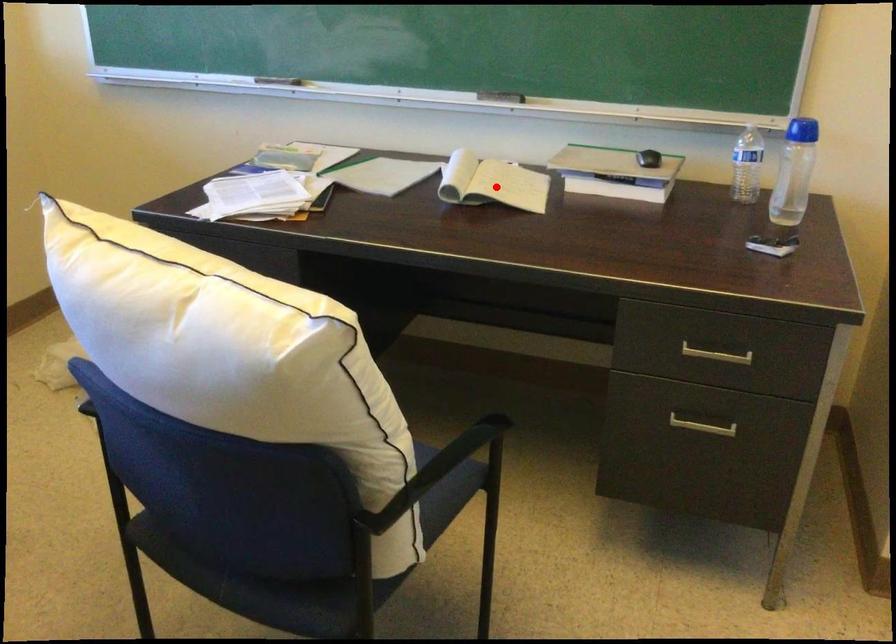
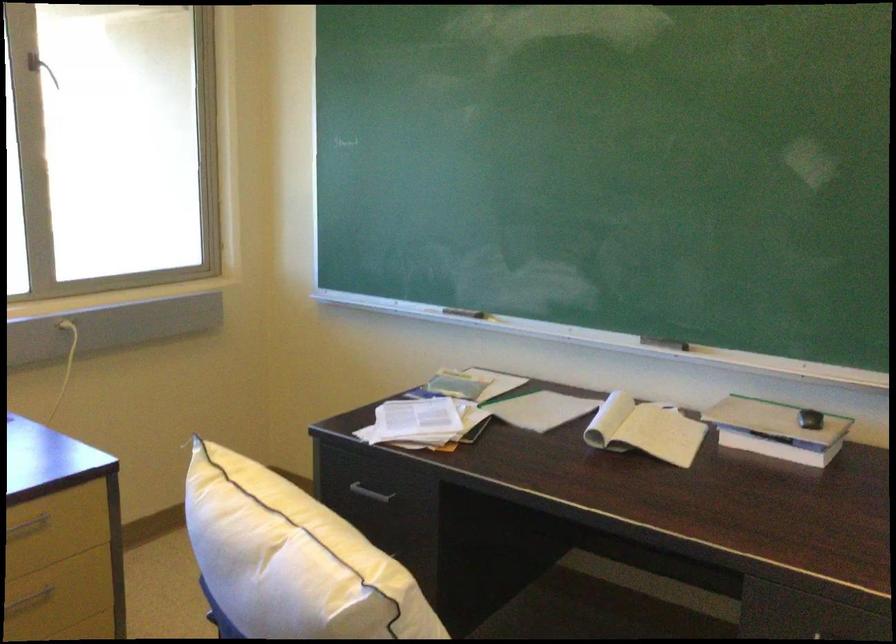
Find the pixel in the second image that matches the highlighted location in the first image.

(644, 430)